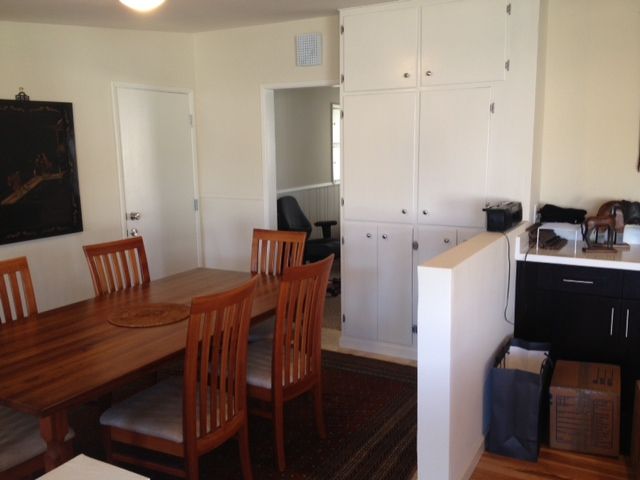
Image resolution: width=640 pixels, height=480 pixels. In order to click on dark brown painting in this screenshot , I will do `click(16, 152)`.